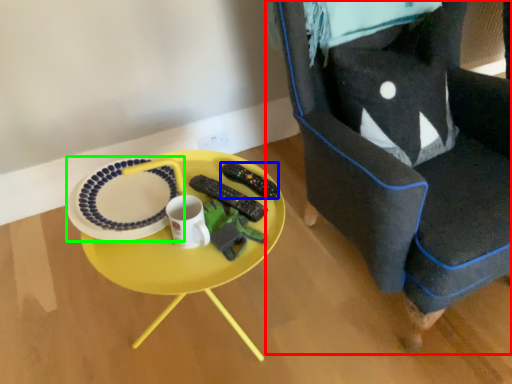
Question: Which object is positioned farthest from chair (highlighted by a red box)? Select from remote control (highlighted by a blue box) and platter (highlighted by a green box).

Choices:
 (A) remote control
 (B) platter

Answer: (B)